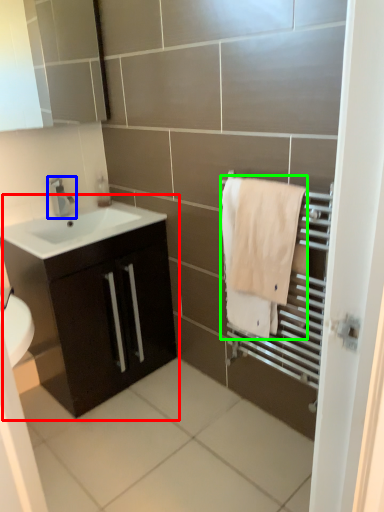
Question: Which is nearer to the bathroom cabinet (highlighted by a red box)? tap (highlighted by a blue box) or bath towel (highlighted by a green box).

Choices:
 (A) tap
 (B) bath towel

Answer: (A)